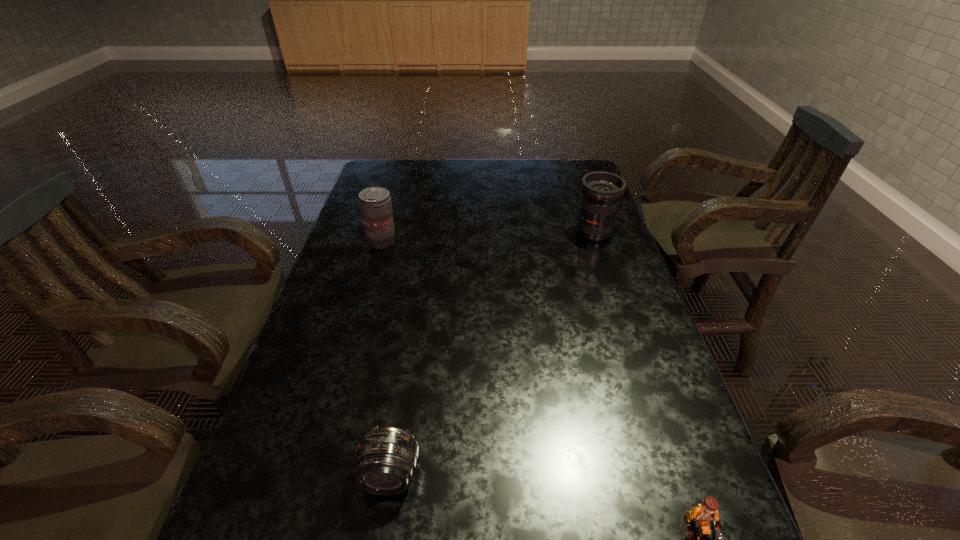
The width and height of the screenshot is (960, 540). Find the location of `blank space at the left edge of the desktop`. blank space at the left edge of the desktop is located at coordinates (348, 260).

I want to click on free space at the right edge of the desktop, so click(x=566, y=225).

In the image, there is a desktop. Find the location of `vacant space at the far left corner`. vacant space at the far left corner is located at coordinates (399, 162).

Where is `free point at the far right corner`? The image size is (960, 540). free point at the far right corner is located at coordinates (567, 180).

The height and width of the screenshot is (540, 960). Find the location of `vacant area that lies between the third object from right to left and the rightmost telephoto lens`. vacant area that lies between the third object from right to left and the rightmost telephoto lens is located at coordinates tap(492, 353).

You are a GUI agent. You are given a task and a screenshot of the screen. Output one action in this format:
    pyautogui.click(x=<x>, y=<y>)
    Task: Click on the vacant area between the second nearest object and the rightmost telephoto lens
    This screenshot has height=540, width=960.
    Given the screenshot: What is the action you would take?
    pyautogui.click(x=492, y=353)

You are a GUI agent. You are given a task and a screenshot of the screen. Output one action in this format:
    pyautogui.click(x=<x>, y=<y>)
    Task: Click on the free space that is in between the third object from right to left and the leftmost object
    This screenshot has width=960, height=540.
    Given the screenshot: What is the action you would take?
    coord(386,358)

This screenshot has height=540, width=960. Identify the location of vacant area that lies between the second telephoto lens from right to left and the leftmost object. (386, 358).

I want to click on vacant space that is in between the rightmost telephoto lens and the second telephoto lens from left to right, so click(492, 353).

Locate an element on the screen. This screenshot has height=540, width=960. free space that is in between the rightmost telephoto lens and the leftmost object is located at coordinates (488, 237).